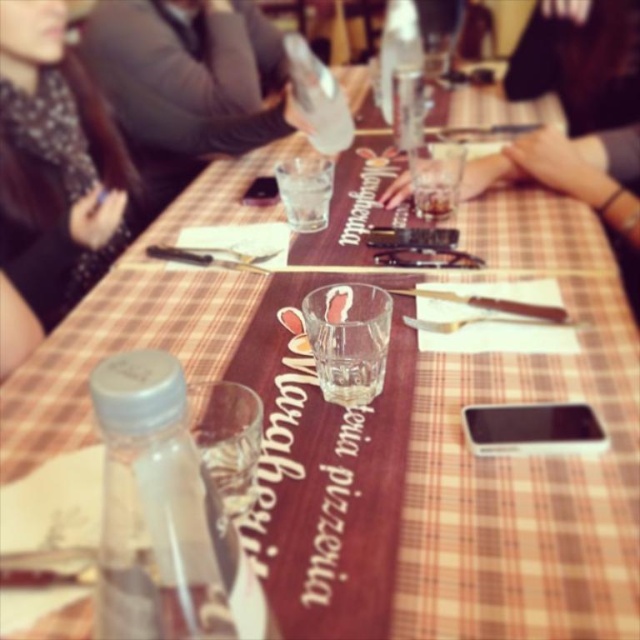
You are a customer at the pizzeria and want to place your smartphone on the table without it tipping over. Which object, the black fabric scarf at upper left or the translucent glass at center, would provide a more stable surface for your phone?

The black fabric scarf at upper left has a greater height compared to the translucent glass at center, so placing the phone on the scarf would provide a more stable surface since it is taller and less likely to tip over.

You are sitting at the table in the image. You want to place your phone on the table so that it is as close as possible to the point at coordinates (51, 177). However, there is already an object at that point. What object is blocking your phone placement?

The point at coordinates (51, 177) is occupied by the black fabric scarf at upper left, so placing the phone there would require moving that object first.